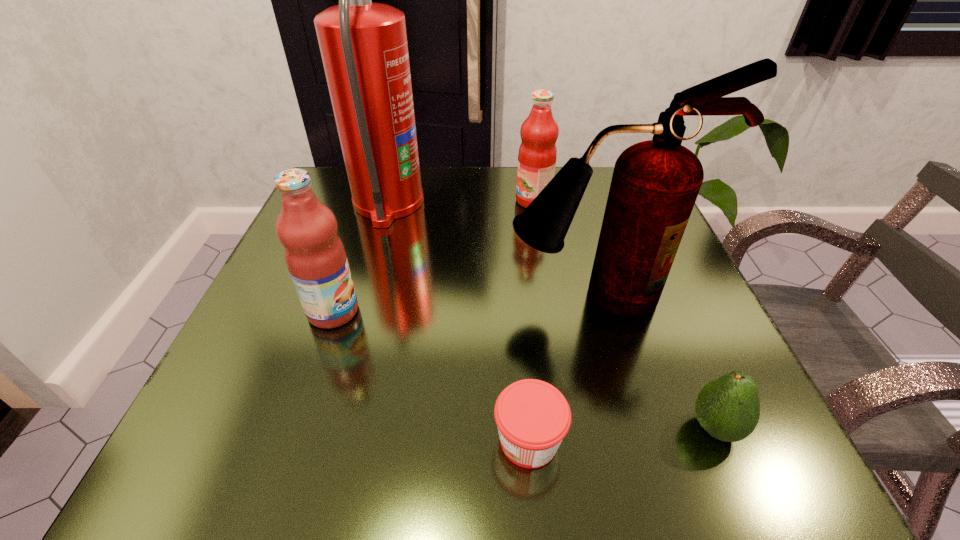
Locate an element on the screen. vacant position in the image that satisfies the following two spatial constraints: 1. at the nozzle of the nearer fire extinguisher; 2. on the label side of the jam is located at coordinates (638, 441).